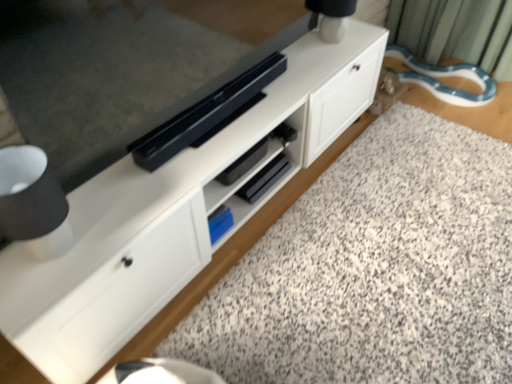
Question: Should I look upward or downward to see granite at lower center?

Choices:
 (A) up
 (B) down

Answer: (B)

Question: Is white matte table lamp at upper right in front of white matte cabinet at center?

Choices:
 (A) yes
 (B) no

Answer: (B)

Question: Considering the relative sizes of white matte table lamp at upper right and white matte cabinet at center in the image provided, is white matte table lamp at upper right taller than white matte cabinet at center?

Choices:
 (A) yes
 (B) no

Answer: (B)

Question: From a real-world perspective, is white matte table lamp at upper right over white matte cabinet at center?

Choices:
 (A) yes
 (B) no

Answer: (A)

Question: Can you confirm if white matte table lamp at upper right is wider than white matte cabinet at center?

Choices:
 (A) yes
 (B) no

Answer: (B)

Question: From a real-world perspective, is white matte table lamp at upper right beneath white matte cabinet at center?

Choices:
 (A) no
 (B) yes

Answer: (A)

Question: Is white matte table lamp at upper right shorter than white matte cabinet at center?

Choices:
 (A) no
 (B) yes

Answer: (B)

Question: Considering the relative sizes of white matte table lamp at upper right and granite at lower center in the image provided, is white matte table lamp at upper right shorter than granite at lower center?

Choices:
 (A) yes
 (B) no

Answer: (B)

Question: From the image's perspective, is white matte table lamp at upper right over granite at lower center?

Choices:
 (A) no
 (B) yes

Answer: (B)

Question: Are white matte table lamp at upper right and granite at lower center far apart?

Choices:
 (A) yes
 (B) no

Answer: (B)

Question: Does white matte table lamp at upper right have a greater height compared to granite at lower center?

Choices:
 (A) yes
 (B) no

Answer: (A)

Question: Is white matte table lamp at upper right aimed at granite at lower center?

Choices:
 (A) no
 (B) yes

Answer: (A)

Question: Is white matte table lamp at upper right positioned in front of granite at lower center?

Choices:
 (A) yes
 (B) no

Answer: (B)

Question: Could you tell me if white matte cabinet at center is turned towards granite at lower center?

Choices:
 (A) no
 (B) yes

Answer: (B)